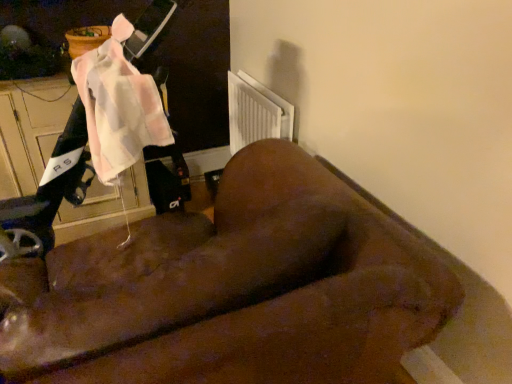
Question: Is pink fabric mobility scooter at upper left oriented towards brown fuzzy couch at center?

Choices:
 (A) yes
 (B) no

Answer: (B)

Question: Considering the relative sizes of pink fabric mobility scooter at upper left and brown fuzzy couch at center in the image provided, is pink fabric mobility scooter at upper left shorter than brown fuzzy couch at center?

Choices:
 (A) no
 (B) yes

Answer: (B)

Question: Does pink fabric mobility scooter at upper left lie in front of brown fuzzy couch at center?

Choices:
 (A) no
 (B) yes

Answer: (A)

Question: Is pink fabric mobility scooter at upper left at the left side of brown fuzzy couch at center?

Choices:
 (A) yes
 (B) no

Answer: (A)

Question: Considering the relative sizes of pink fabric mobility scooter at upper left and brown fuzzy couch at center in the image provided, is pink fabric mobility scooter at upper left thinner than brown fuzzy couch at center?

Choices:
 (A) yes
 (B) no

Answer: (A)

Question: Does pink fabric mobility scooter at upper left contain brown fuzzy couch at center?

Choices:
 (A) no
 (B) yes

Answer: (A)

Question: Does brown fuzzy couch at center come in front of pink fabric mobility scooter at upper left?

Choices:
 (A) no
 (B) yes

Answer: (B)

Question: From a real-world perspective, is brown fuzzy couch at center positioned under pink fabric mobility scooter at upper left based on gravity?

Choices:
 (A) no
 (B) yes

Answer: (B)

Question: Are brown fuzzy couch at center and pink fabric mobility scooter at upper left located far from each other?

Choices:
 (A) yes
 (B) no

Answer: (B)

Question: Does brown fuzzy couch at center have a greater height compared to pink fabric mobility scooter at upper left?

Choices:
 (A) yes
 (B) no

Answer: (A)

Question: Does brown fuzzy couch at center have a larger size compared to pink fabric mobility scooter at upper left?

Choices:
 (A) yes
 (B) no

Answer: (A)

Question: Is pink fabric mobility scooter at upper left located within brown fuzzy couch at center?

Choices:
 (A) yes
 (B) no

Answer: (B)

Question: From the image's perspective, relative to brown fuzzy couch at center, is pink fabric mobility scooter at upper left above or below?

Choices:
 (A) above
 (B) below

Answer: (A)